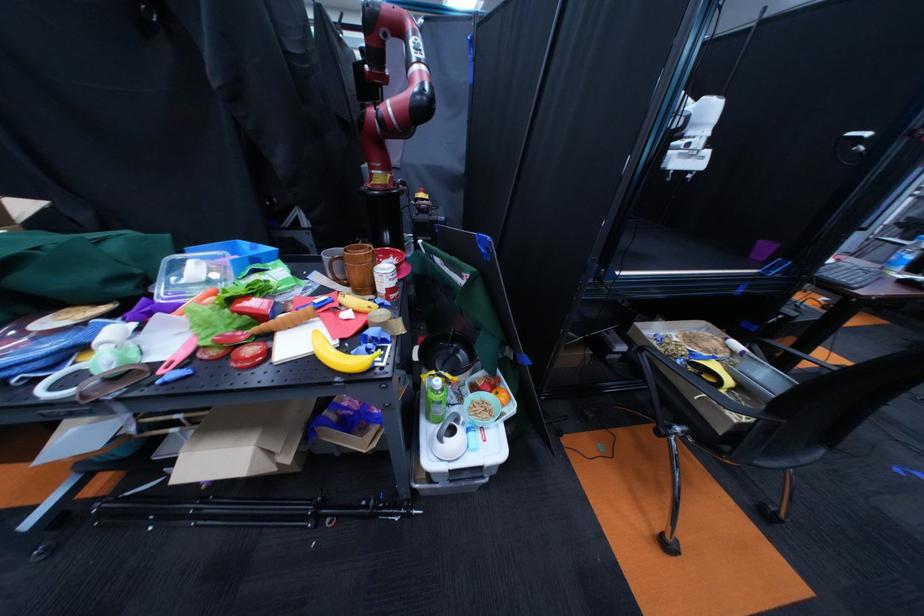
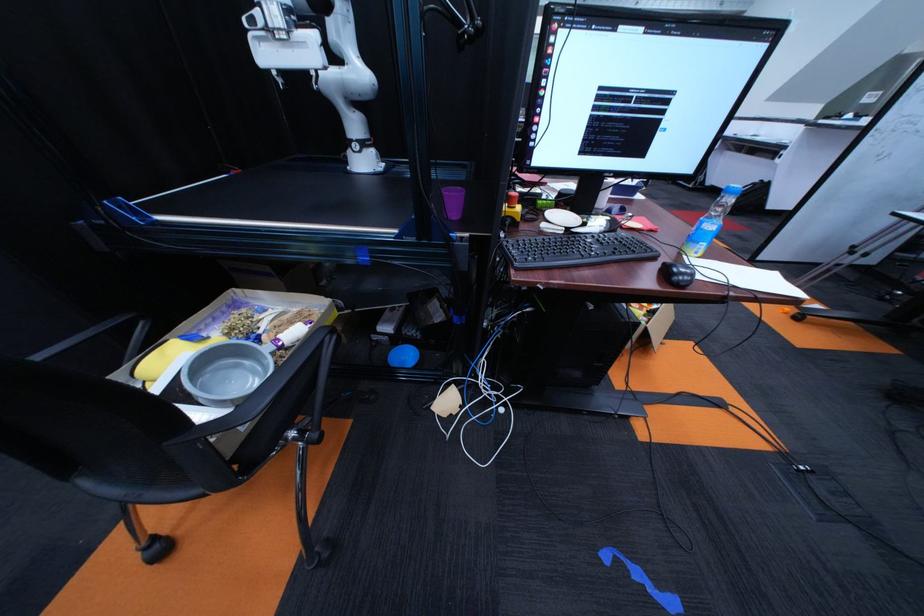
Question: In a continuous first-person perspective shot, in which direction is the camera moving?

Choices:
 (A) Left
 (B) Right
 (C) Forward
 (D) Backward

Answer: (B)